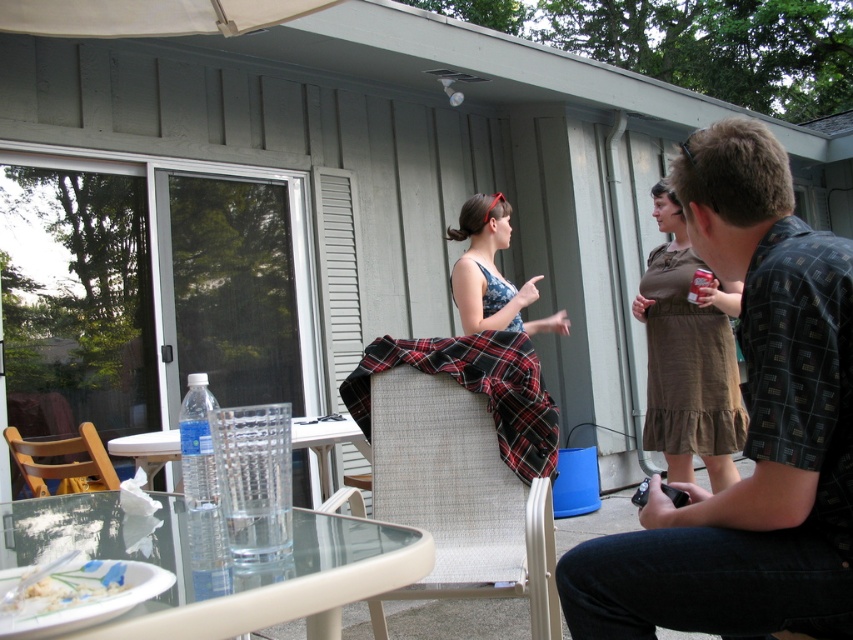
Does point (248, 216) come closer to viewer compared to point (708, 349)?

No.

Locate an element on the screen. transparent plastic screen door at center is located at coordinates (230, 289).

This screenshot has width=853, height=640. I want to click on brown cotton dress at center, so click(688, 356).

What do you see at coordinates (688, 356) in the screenshot? I see `brown cotton dress at center` at bounding box center [688, 356].

The image size is (853, 640). I want to click on brown cotton dress at center, so click(x=688, y=356).

From the picture: Can you confirm if plaid fabric chair at center is smaller than brown wooden chair at lower left?

Correct, plaid fabric chair at center occupies less space than brown wooden chair at lower left.

Who is shorter, plaid fabric chair at center or brown wooden chair at lower left?

brown wooden chair at lower left

Does point (544, 556) come farther from viewer compared to point (90, 426)?

No.

Locate an element on the screen. The width and height of the screenshot is (853, 640). plaid fabric chair at center is located at coordinates (457, 497).